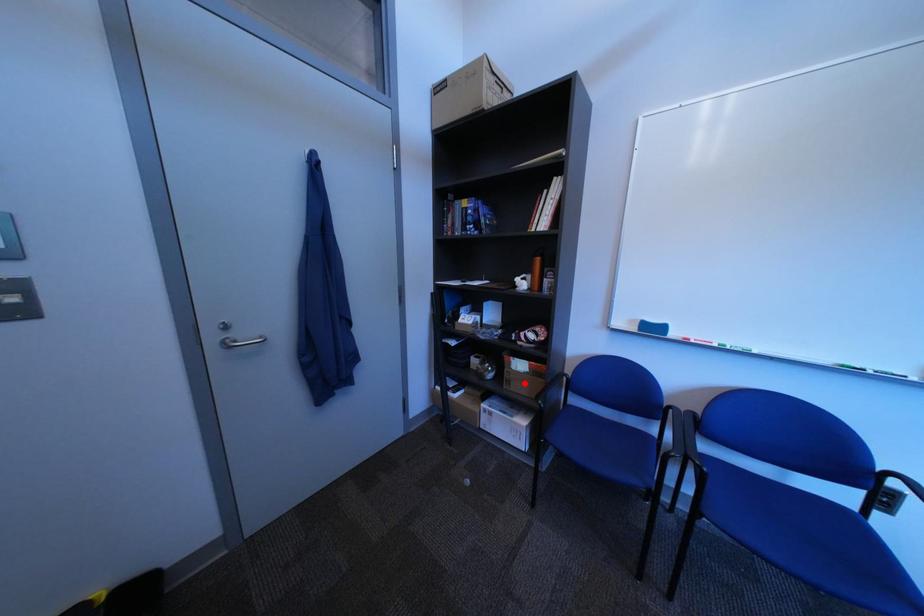
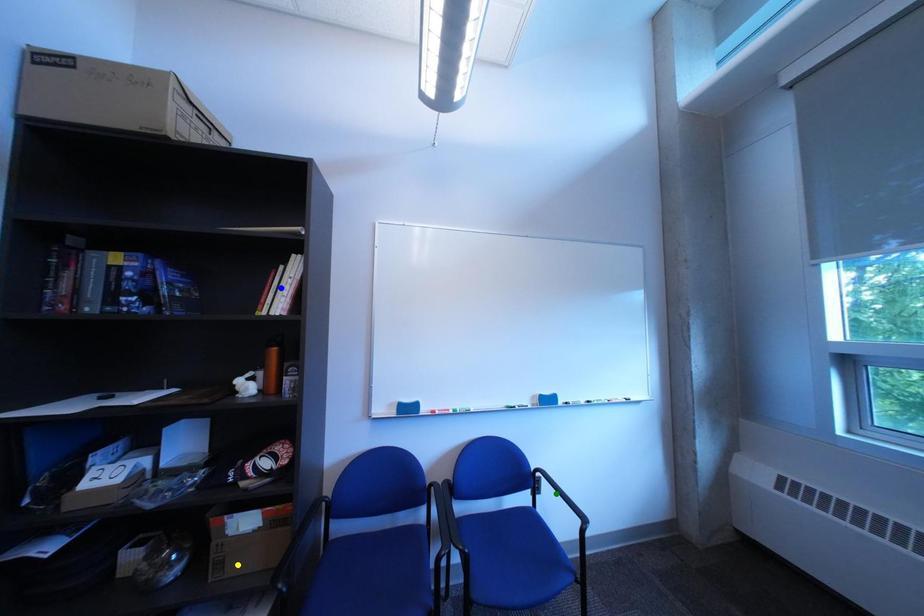
Question: I am providing you with two images of the same scene from different viewpoints. A red point is marked on the first image. You are given multiple points on the second image. Which mark in image 2 goes with the point in image 1?

Choices:
 (A) green point
 (B) yellow point
 (C) blue point

Answer: (B)